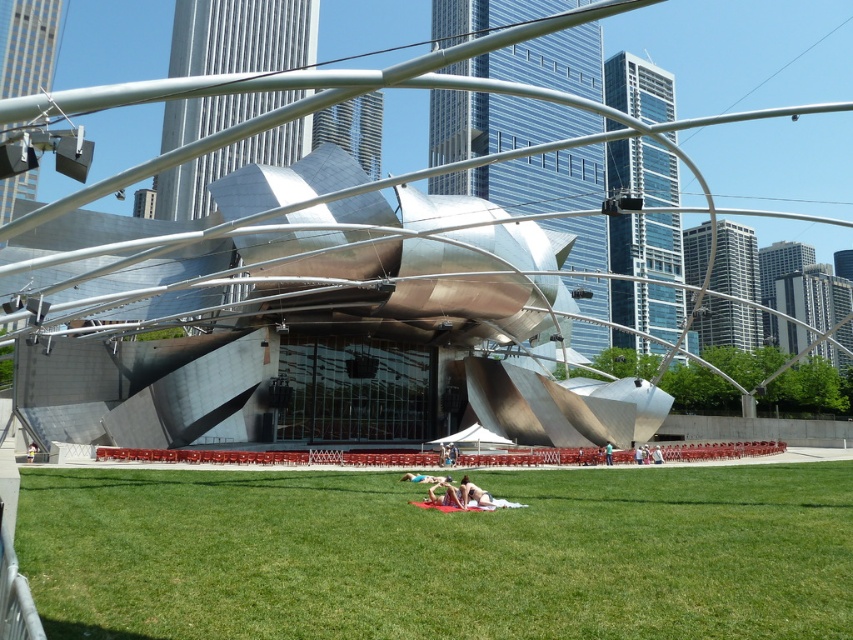
You are a photographer positioned behind the smooth skin person at center. Can you see the skinny jeans at center through them?

The skinny jeans at center is in front of the smooth skin person at center, so the photographer cannot see the skinny jeans at center through them.

You are standing at the center of the grassy area in the urban park scene. You notice a point marked at coordinates (444, 493). What object is located at that point?

The point at coordinates (444, 493) is located on skinny jeans at center.